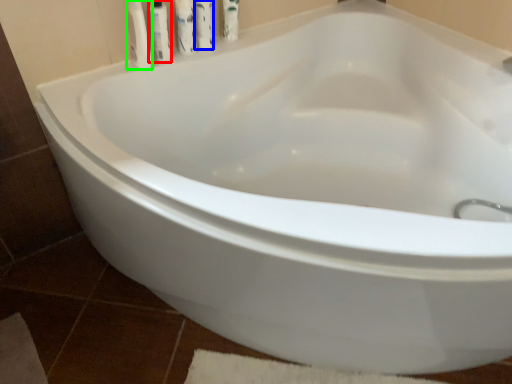
Question: Which object is the closest to the toiletry (highlighted by a red box)? Choose among these: cleaning product (highlighted by a blue box) or toiletry (highlighted by a green box).

Choices:
 (A) cleaning product
 (B) toiletry

Answer: (B)